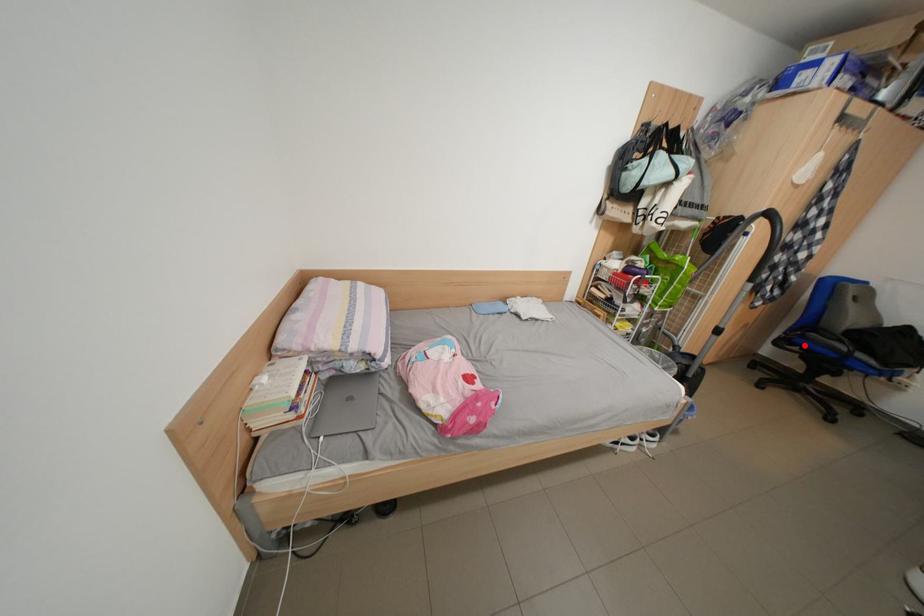
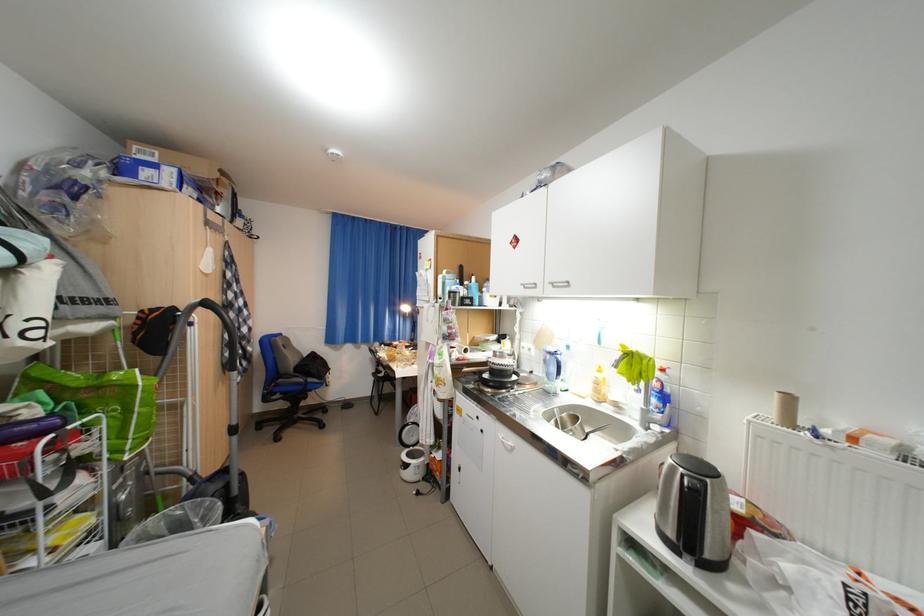
The point at the highlighted location is marked in the first image. Where is the corresponding point in the second image?

(286, 395)